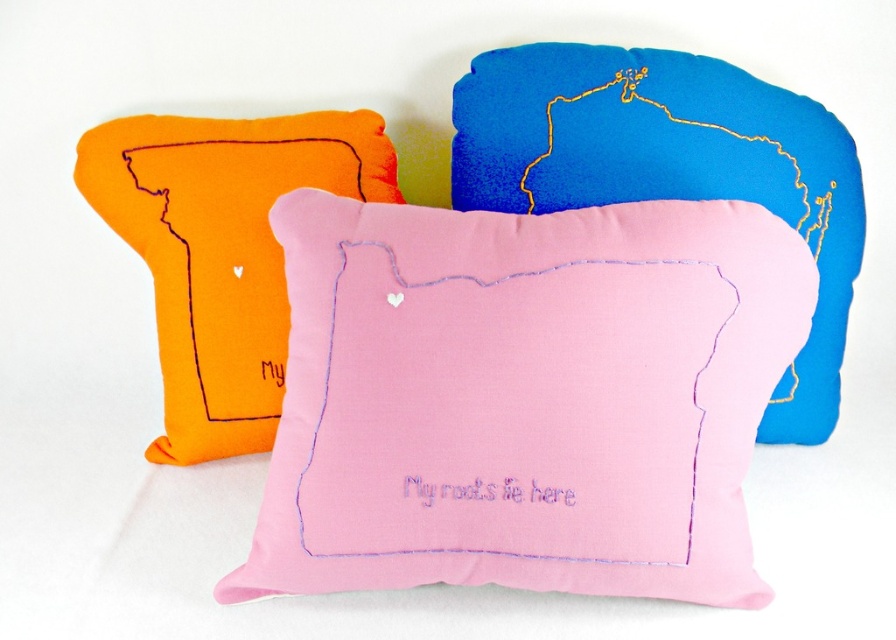
Question: Does pink fabric pillow at center have a greater width compared to pink fabric cushion at center?

Choices:
 (A) no
 (B) yes

Answer: (B)

Question: Is pink fabric pillow at center below pink fabric cushion at center?

Choices:
 (A) no
 (B) yes

Answer: (B)

Question: Which of the following is the farthest from the observer?

Choices:
 (A) pink fabric cushion at center
 (B) orange felt pillow at left

Answer: (A)

Question: Can you confirm if pink fabric pillow at center is smaller than orange felt pillow at left?

Choices:
 (A) yes
 (B) no

Answer: (B)

Question: Which of the following is the closest to the observer?

Choices:
 (A) (159, 180)
 (B) (854, 236)

Answer: (A)

Question: Which point is closer to the camera?

Choices:
 (A) (653, 67)
 (B) (186, 452)

Answer: (A)